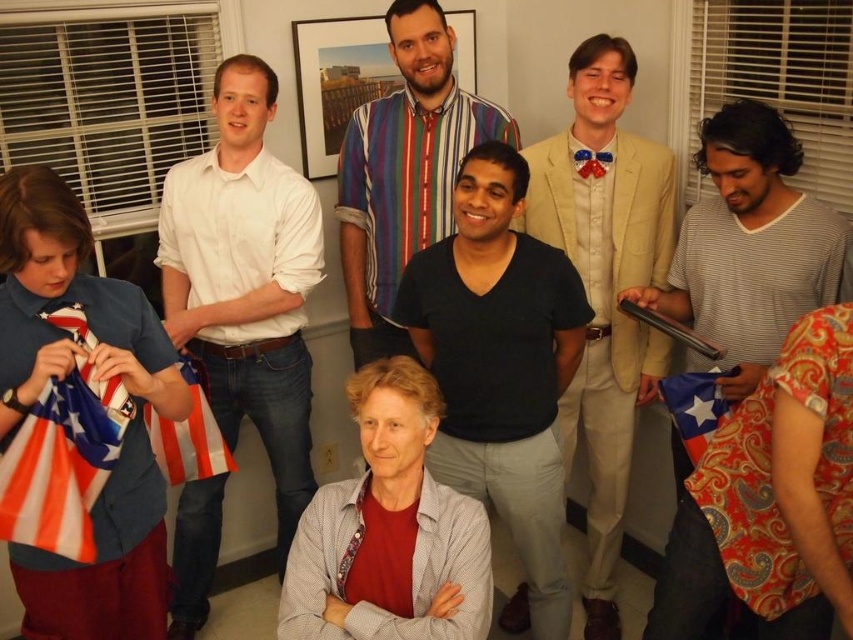
Which is in front, point (529, 288) or point (706, 388)?

Point (529, 288)

Can you confirm if black cotton shirt at center is positioned to the left of blue and white fabric flag at lower right?

Correct, you'll find black cotton shirt at center to the left of blue and white fabric flag at lower right.

Does point (526, 186) come farther from viewer compared to point (686, 403)?

No, (526, 186) is in front of (686, 403).

This screenshot has height=640, width=853. I want to click on black cotton shirt at center, so tap(500, 364).

Can you confirm if dark blue shirt at center is wider than american flag at lower left?

Yes, dark blue shirt at center is wider than american flag at lower left.

Measure the distance between point [433,186] and camera.

Point [433,186] and camera are 8.38 feet apart.

Where is `dark blue shirt at center`? This screenshot has height=640, width=853. dark blue shirt at center is located at coordinates (404, 172).

Consider the image. Does american flag at left appear on the left side of blue and white fabric flag at lower right?

Correct, you'll find american flag at left to the left of blue and white fabric flag at lower right.

Does american flag at left have a lesser height compared to blue and white fabric flag at lower right?

No.

Which is behind, point (97, 452) or point (695, 420)?

Point (695, 420)

Find the location of `american flag at left`. american flag at left is located at coordinates (62, 464).